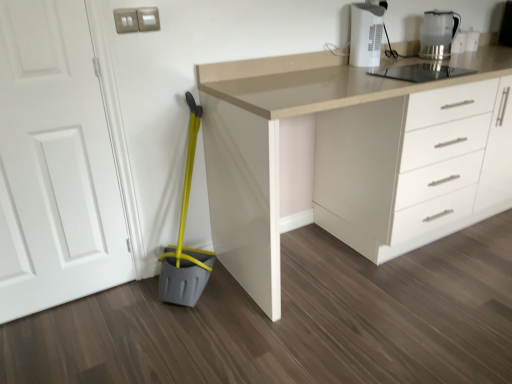
Question: Is white plastic coffee maker at upper right not near beige laminate countertop at center?

Choices:
 (A) no
 (B) yes

Answer: (A)

Question: Would you say beige laminate countertop at center is part of white plastic coffee maker at upper right's contents?

Choices:
 (A) yes
 (B) no

Answer: (B)

Question: Considering the relative sizes of white plastic coffee maker at upper right and beige laminate countertop at center in the image provided, is white plastic coffee maker at upper right taller than beige laminate countertop at center?

Choices:
 (A) no
 (B) yes

Answer: (A)

Question: From a real-world perspective, is white plastic coffee maker at upper right positioned under beige laminate countertop at center based on gravity?

Choices:
 (A) yes
 (B) no

Answer: (B)

Question: Considering the relative sizes of white plastic coffee maker at upper right and beige laminate countertop at center in the image provided, is white plastic coffee maker at upper right smaller than beige laminate countertop at center?

Choices:
 (A) yes
 (B) no

Answer: (A)

Question: Is white plastic coffee maker at upper right further to the viewer compared to beige laminate countertop at center?

Choices:
 (A) yes
 (B) no

Answer: (A)

Question: From a real-world perspective, is white plastic coffee maker at upper right located beneath white matte door at left?

Choices:
 (A) yes
 (B) no

Answer: (B)

Question: From the image's perspective, is white plastic coffee maker at upper right beneath white matte door at left?

Choices:
 (A) no
 (B) yes

Answer: (A)

Question: Does white plastic coffee maker at upper right appear on the right side of white matte door at left?

Choices:
 (A) no
 (B) yes

Answer: (B)

Question: Is white plastic coffee maker at upper right positioned before white matte door at left?

Choices:
 (A) no
 (B) yes

Answer: (A)

Question: Can you confirm if white plastic coffee maker at upper right is positioned to the left of white matte door at left?

Choices:
 (A) yes
 (B) no

Answer: (B)

Question: Does white plastic coffee maker at upper right have a larger size compared to white matte door at left?

Choices:
 (A) no
 (B) yes

Answer: (A)

Question: Is beige laminate countertop at center at the right side of translucent glass kettle at upper right?

Choices:
 (A) yes
 (B) no

Answer: (A)